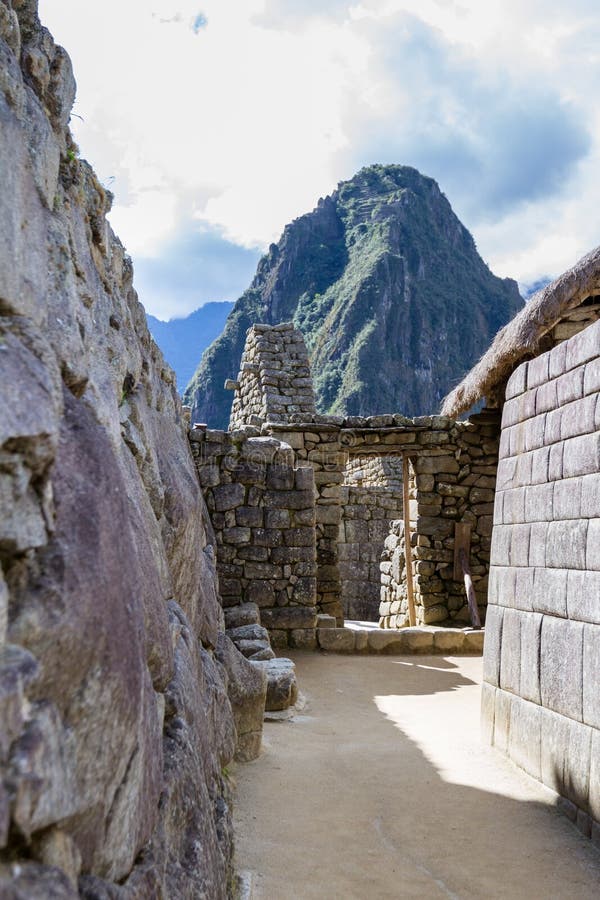
I want to click on entryway, so click(x=369, y=626).